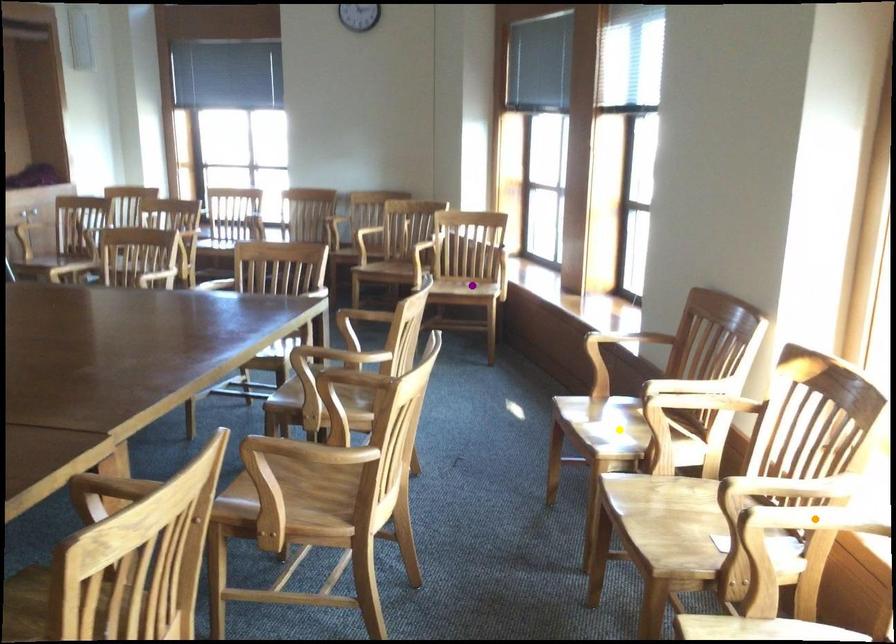
Based on the photo, order these from farthest to nearest:
orange point, yellow point, purple point

1. purple point
2. yellow point
3. orange point